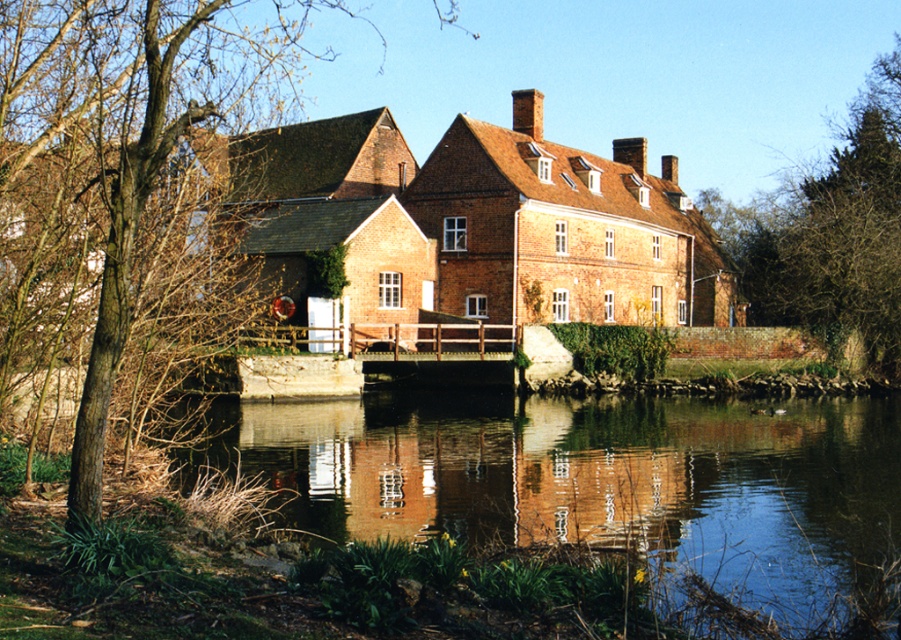
Is smooth reflective water at center to the right of green leafy tree at upper right from the viewer's perspective?

No, smooth reflective water at center is not to the right of green leafy tree at upper right.

How much distance is there between smooth reflective water at center and green leafy tree at upper right?

A distance of 127.90 feet exists between smooth reflective water at center and green leafy tree at upper right.

Describe the element at coordinates (610, 484) in the screenshot. I see `smooth reflective water at center` at that location.

Find the location of `smooth reflective water at center`. smooth reflective water at center is located at coordinates (610, 484).

Is point (724, 545) closer to viewer compared to point (61, 300)?

That is False.

Does point (517, 426) come behind point (99, 166)?

Yes, it is behind point (99, 166).

Is point (772, 570) less distant than point (150, 51)?

No, (772, 570) is further to viewer.

Where is `smooth reflective water at center`? The width and height of the screenshot is (901, 640). smooth reflective water at center is located at coordinates (610, 484).

Who is taller, brown leafless tree at left or green leafy tree at upper right?

Standing taller between the two is brown leafless tree at left.

Is brown leafless tree at left to the left of green leafy tree at upper right from the viewer's perspective?

Yes, brown leafless tree at left is to the left of green leafy tree at upper right.

Who is more forward, (61, 285) or (878, 264)?

Point (61, 285) is in front.

Image resolution: width=901 pixels, height=640 pixels. In order to click on brown leafless tree at left in this screenshot , I will do `click(119, 182)`.